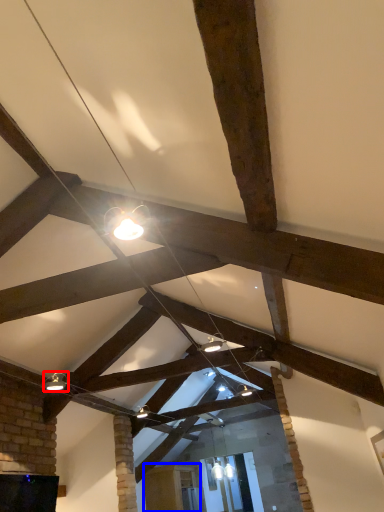
Question: Which object appears closest to the camera in this image, light fixture (highlighted by a red box) or furniture (highlighted by a blue box)?

Choices:
 (A) light fixture
 (B) furniture

Answer: (A)